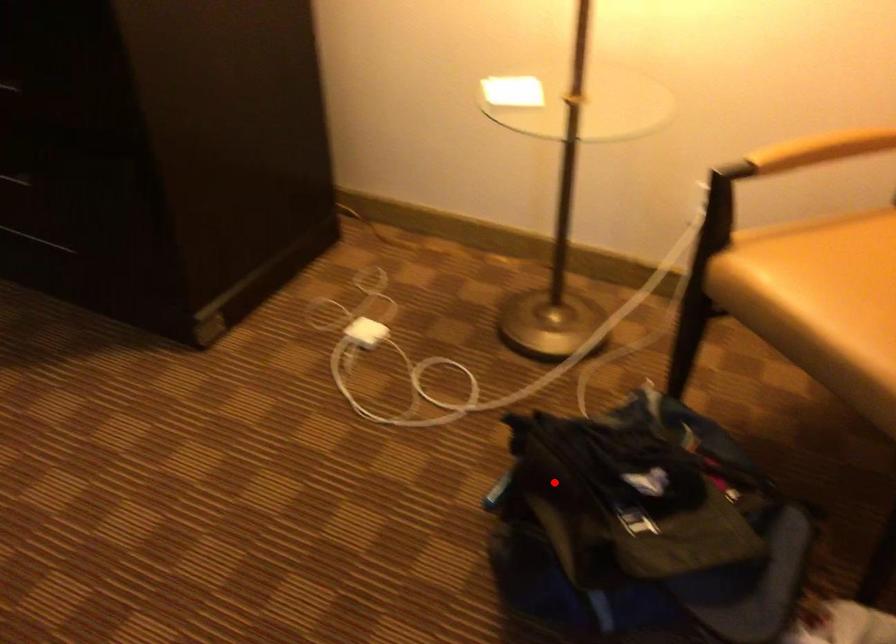
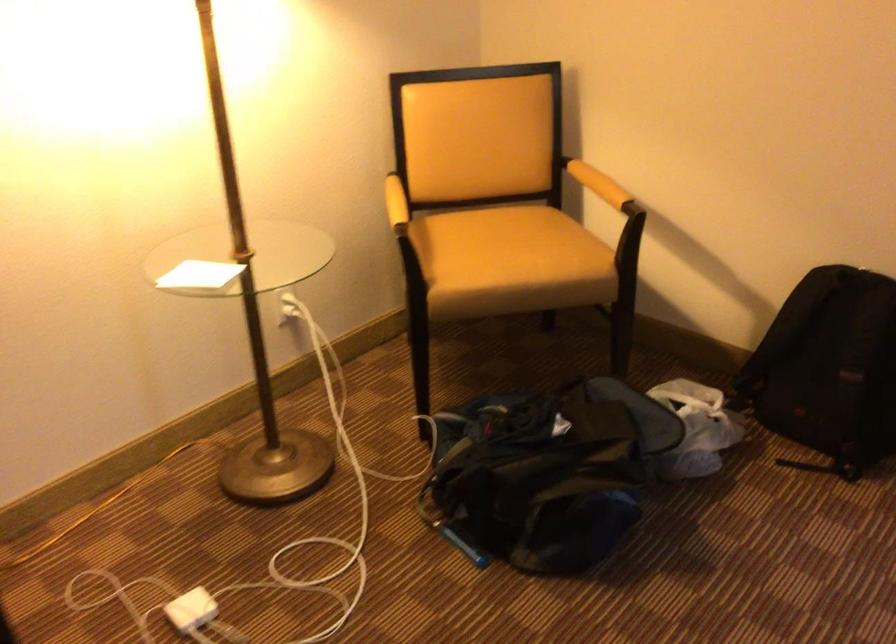
Find the pixel in the second image that matches the highlighted location in the first image.

(537, 480)